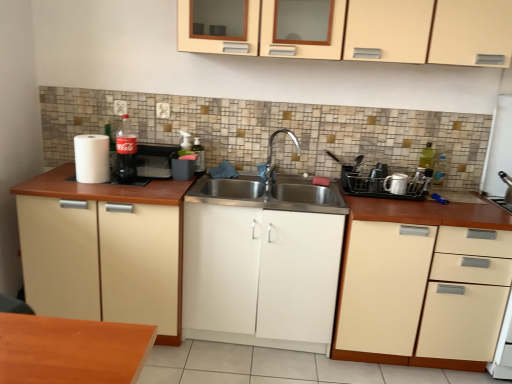
Question: Considering the relative positions of white matte paper towel at left and white glossy mug at right, the 3th appliance in the left-to-right sequence, in the image provided, is white matte paper towel at left to the left of white glossy mug at right, the 3th appliance in the left-to-right sequence, from the viewer's perspective?

Choices:
 (A) no
 (B) yes

Answer: (B)

Question: Can you confirm if white matte paper towel at left is wider than white glossy mug at right, the 3th appliance in the left-to-right sequence?

Choices:
 (A) no
 (B) yes

Answer: (B)

Question: Is white matte paper towel at left thinner than white glossy mug at right, the first appliance from the right?

Choices:
 (A) no
 (B) yes

Answer: (A)

Question: Is white matte paper towel at left facing away from white glossy mug at right, the first appliance from the right?

Choices:
 (A) yes
 (B) no

Answer: (B)

Question: Is white matte paper towel at left positioned in front of white glossy mug at right, the first appliance from the right?

Choices:
 (A) yes
 (B) no

Answer: (A)

Question: Would you say beige matte cabinet at right, marked as the 4th cabinetry in a left-to-right arrangement, is inside or outside beige matte cabinet at left, acting as the 4th cabinetry starting from the right?

Choices:
 (A) outside
 (B) inside

Answer: (A)

Question: From a real-world perspective, is beige matte cabinet at right, placed as the first cabinetry when sorted from right to left, above or below beige matte cabinet at left, positioned as the 1th cabinetry in left-to-right order?

Choices:
 (A) below
 (B) above

Answer: (A)

Question: In the image, is beige matte cabinet at right, marked as the 4th cabinetry in a left-to-right arrangement, positioned in front of or behind beige matte cabinet at left, positioned as the 1th cabinetry in left-to-right order?

Choices:
 (A) front
 (B) behind

Answer: (A)

Question: From the image's perspective, is beige matte cabinet at right, marked as the 4th cabinetry in a left-to-right arrangement, located above or below beige matte cabinet at left, positioned as the 1th cabinetry in left-to-right order?

Choices:
 (A) above
 (B) below

Answer: (B)

Question: Considering their positions, is white glossy mug at right, the 3th appliance in the left-to-right sequence, located in front of or behind beige matte cabinet at left, positioned as the 1th cabinetry in left-to-right order?

Choices:
 (A) behind
 (B) front

Answer: (A)

Question: Is white glossy mug at right, the 3th appliance in the left-to-right sequence, inside the boundaries of beige matte cabinet at left, positioned as the 1th cabinetry in left-to-right order, or outside?

Choices:
 (A) inside
 (B) outside

Answer: (B)

Question: In terms of size, does white glossy mug at right, the first appliance from the right, appear bigger or smaller than beige matte cabinet at left, acting as the 4th cabinetry starting from the right?

Choices:
 (A) big
 (B) small

Answer: (B)

Question: Is white glossy mug at right, the first appliance from the right, taller or shorter than beige matte cabinet at left, positioned as the 1th cabinetry in left-to-right order?

Choices:
 (A) short
 (B) tall

Answer: (A)

Question: Looking at the image, does black plastic dish rack at right, which is the second appliance in left-to-right order, seem bigger or smaller compared to beige matte cabinet at right, marked as the 4th cabinetry in a left-to-right arrangement?

Choices:
 (A) big
 (B) small

Answer: (B)

Question: In terms of width, does black plastic dish rack at right, which is the second appliance in left-to-right order, look wider or thinner when compared to beige matte cabinet at right, placed as the first cabinetry when sorted from right to left?

Choices:
 (A) wide
 (B) thin

Answer: (B)